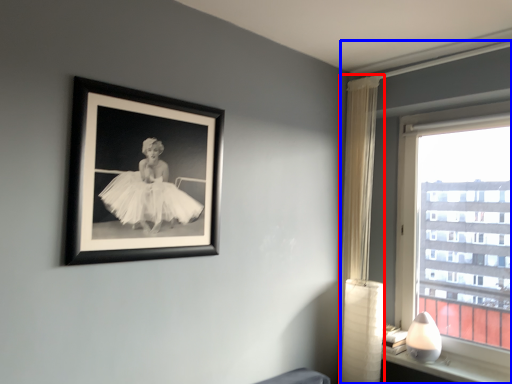
Question: Which point is further to the camera, curtain (highlighted by a red box) or window (highlighted by a blue box)?

Choices:
 (A) curtain
 (B) window

Answer: (A)